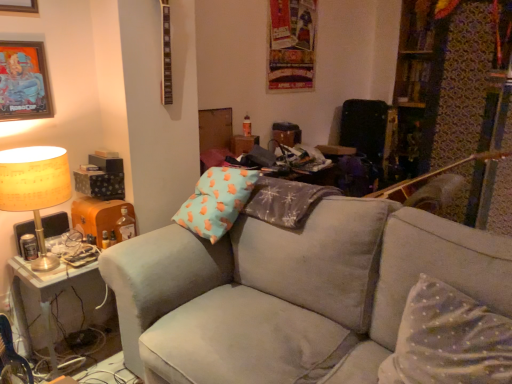
Question: Is white dotted fabric pillow at lower right directly adjacent to metallic brass table at lower left?

Choices:
 (A) no
 (B) yes

Answer: (A)

Question: From the image's perspective, does white dotted fabric pillow at lower right appear lower than metallic brass table at lower left?

Choices:
 (A) no
 (B) yes

Answer: (A)

Question: From a real-world perspective, is white dotted fabric pillow at lower right physically above metallic brass table at lower left?

Choices:
 (A) no
 (B) yes

Answer: (B)

Question: Is white dotted fabric pillow at lower right positioned with its back to metallic brass table at lower left?

Choices:
 (A) yes
 (B) no

Answer: (B)

Question: Is white dotted fabric pillow at lower right not close to metallic brass table at lower left?

Choices:
 (A) no
 (B) yes

Answer: (B)

Question: Is white dotted fabric pillow at lower right taller than metallic brass table at lower left?

Choices:
 (A) yes
 (B) no

Answer: (A)

Question: Is metallic picture frame at upper left, the 1th picture frame from the top, further to camera compared to white dotted fabric pillow at lower right?

Choices:
 (A) yes
 (B) no

Answer: (A)

Question: Is metallic picture frame at upper left, the 1th picture frame from the top, at the left side of white dotted fabric pillow at lower right?

Choices:
 (A) yes
 (B) no

Answer: (A)

Question: Would you say metallic picture frame at upper left, the 1th picture frame from the top, contains white dotted fabric pillow at lower right?

Choices:
 (A) no
 (B) yes

Answer: (A)

Question: Does metallic picture frame at upper left, the 1th picture frame from the top, have a greater height compared to white dotted fabric pillow at lower right?

Choices:
 (A) no
 (B) yes

Answer: (A)

Question: Could you tell me if metallic picture frame at upper left, the 1th picture frame from the top, is turned towards white dotted fabric pillow at lower right?

Choices:
 (A) yes
 (B) no

Answer: (B)

Question: From a real-world perspective, is metallic picture frame at upper left, the 1th picture frame from the top, under white dotted fabric pillow at lower right?

Choices:
 (A) yes
 (B) no

Answer: (B)

Question: Is metallic silver picture frame at upper left, which ranks as the second picture frame in top-to-bottom order, not near white dotted fabric pillow at lower right?

Choices:
 (A) yes
 (B) no

Answer: (A)